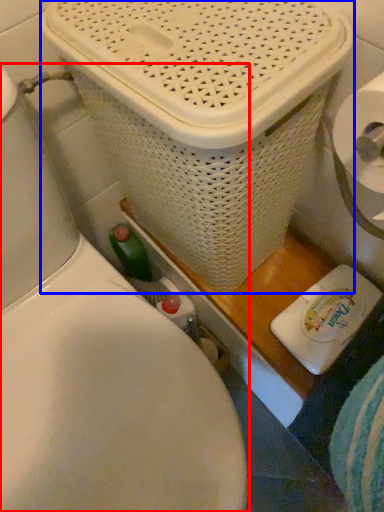
Question: Which of the following is the closest to the observer, toilet (highlighted by a red box) or basket container (highlighted by a blue box)?

Choices:
 (A) toilet
 (B) basket container

Answer: (A)